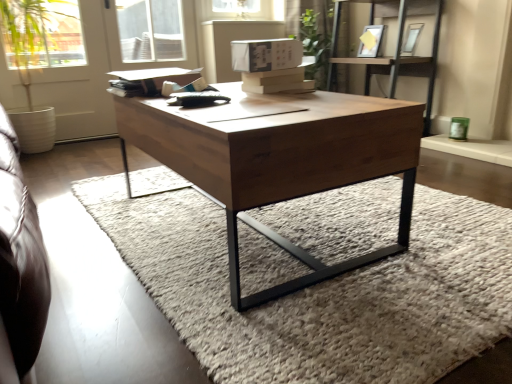
Locate an element on the screen. green leafy plant at upper center is located at coordinates (312, 33).

Measure the distance between wooden coffee table at center and camera.

wooden coffee table at center is 34.90 inches from camera.

The width and height of the screenshot is (512, 384). What do you see at coordinates (396, 50) in the screenshot? I see `wooden shelf at upper right` at bounding box center [396, 50].

Find the location of a particular element. green leafy plant at upper center is located at coordinates (312, 33).

Which point is more distant from viewer, (36, 79) or (162, 25)?

The point (162, 25) is more distant.

Is white matte screen door at upper left positioned far away from transparent glass window at upper center?

They are positioned close to each other.

From the image's perspective, which one is positioned higher, white matte screen door at upper left or transparent glass window at upper center?

transparent glass window at upper center, from the image's perspective.

Is white matte screen door at upper left bigger than transparent glass window at upper center?

Correct, white matte screen door at upper left is larger in size than transparent glass window at upper center.

Considering the sizes of transparent glass window at upper center and wooden coffee table at center in the image, is transparent glass window at upper center wider or thinner than wooden coffee table at center?

In the image, transparent glass window at upper center appears to be more narrow than wooden coffee table at center.

Which is in front, point (123, 45) or point (329, 142)?

The point (329, 142) is more forward.

Is wooden shelf at upper right touching white matte screen door at upper left?

wooden shelf at upper right and white matte screen door at upper left are clearly separated.

From the image's perspective, between wooden shelf at upper right and white matte screen door at upper left, who is located below?

white matte screen door at upper left.

From a real-world perspective, which is physically below, wooden shelf at upper right or white matte screen door at upper left?

wooden shelf at upper right.

Considering the positions of point (376, 25) and point (134, 21), is point (376, 25) closer or farther from the camera than point (134, 21)?

Clearly, point (376, 25) is closer to the camera than point (134, 21).

Is matte white picture frame at upper center, arranged as the second picture frame when viewed from the right, bigger or smaller than transparent glass window at upper center?

matte white picture frame at upper center, arranged as the second picture frame when viewed from the right, is smaller than transparent glass window at upper center.

Considering the relative sizes of matte white picture frame at upper center, positioned as the 1th picture frame in left-to-right order, and transparent glass window at upper center in the image provided, is matte white picture frame at upper center, positioned as the 1th picture frame in left-to-right order, wider than transparent glass window at upper center?

Indeed, matte white picture frame at upper center, positioned as the 1th picture frame in left-to-right order, has a greater width compared to transparent glass window at upper center.

From a real-world perspective, which is physically above, matte white picture frame at upper center, positioned as the 1th picture frame in left-to-right order, or transparent glass window at upper center?

In real-world perspective, transparent glass window at upper center is above.

Considering the sizes of objects transparent glass window at upper center and wooden shelf at upper right in the image provided, who is taller, transparent glass window at upper center or wooden shelf at upper right?

wooden shelf at upper right is taller.

Where is `shelf located on the right of transparent glass window at upper center`? The image size is (512, 384). shelf located on the right of transparent glass window at upper center is located at coordinates (396, 50).

In the image, is transparent glass window at upper center positioned in front of or behind wooden shelf at upper right?

transparent glass window at upper center is behind wooden shelf at upper right.

From the image's perspective, is soft wool rug at center on green leafy plant at upper center?

Actually, soft wool rug at center appears below green leafy plant at upper center in the image.

Does point (365, 324) appear closer or farther from the camera than point (322, 21)?

Point (365, 324) appears to be closer to the viewer than point (322, 21).

Can we say soft wool rug at center lies outside green leafy plant at upper center?

Absolutely, soft wool rug at center is external to green leafy plant at upper center.

Who is more distant, wooden coffee table at center or transparent glass window at upper center?

transparent glass window at upper center is more distant.

The width and height of the screenshot is (512, 384). I want to click on coffee table lying in front of the transparent glass window at upper center, so click(279, 159).

Is wooden coffee table at center wider or thinner than transparent glass window at upper center?

Considering their sizes, wooden coffee table at center looks broader than transparent glass window at upper center.

Based on the photo, from the image's perspective, is wooden coffee table at center located beneath transparent glass window at upper center?

Yes.

Where is `screen door below the transparent glass window at upper center (from a real-world perspective)`? Image resolution: width=512 pixels, height=384 pixels. screen door below the transparent glass window at upper center (from a real-world perspective) is located at coordinates (80, 84).

Identify the location of coffee table lying in front of the transparent glass window at upper center. (279, 159).

When comparing their distances from matte silver picture frame at upper right, which is the 1th picture frame in right-to-left order, does green leafy plant at upper center or wooden shelf at upper right seem further?

green leafy plant at upper center is further to matte silver picture frame at upper right, which is the 1th picture frame in right-to-left order.

Considering their positions, is green leafy plant at upper center positioned closer to matte white picture frame at upper center, arranged as the second picture frame when viewed from the right, than transparent glass window at upper center?

Based on the image, green leafy plant at upper center appears to be nearer to matte white picture frame at upper center, arranged as the second picture frame when viewed from the right.

From the image, which object appears to be farther from wooden shelf at upper right, white matte screen door at upper left or wooden coffee table at center?

The object further to wooden shelf at upper right is white matte screen door at upper left.

Looking at the image, which one is located closer to wooden coffee table at center, white matte screen door at upper left or matte silver picture frame at upper right, arranged as the 2th picture frame when viewed from the left?

The object closer to wooden coffee table at center is white matte screen door at upper left.

Considering their positions, is transparent glass window at upper center positioned further to white matte screen door at upper left than wooden coffee table at center?

wooden coffee table at center is further to white matte screen door at upper left.

When comparing their distances from wooden shelf at upper right, does transparent glass window at upper center or wooden coffee table at center seem closer?

transparent glass window at upper center.

Considering their positions, is white matte screen door at upper left positioned closer to matte white picture frame at upper center, positioned as the 1th picture frame in left-to-right order, than matte silver picture frame at upper right, which is the 1th picture frame in right-to-left order?

matte silver picture frame at upper right, which is the 1th picture frame in right-to-left order, is positioned closer to the anchor matte white picture frame at upper center, positioned as the 1th picture frame in left-to-right order.

Estimate the real-world distances between objects in this image. Which object is further from wooden shelf at upper right, matte silver picture frame at upper right, arranged as the 2th picture frame when viewed from the left, or green leafy plant at upper center?

Based on the image, green leafy plant at upper center appears to be further to wooden shelf at upper right.

Where is `window between white matte screen door at upper left and matte white picture frame at upper center, positioned as the 1th picture frame in left-to-right order`? Image resolution: width=512 pixels, height=384 pixels. window between white matte screen door at upper left and matte white picture frame at upper center, positioned as the 1th picture frame in left-to-right order is located at coordinates (150, 30).

Locate an element on the screen. screen door located between soft wool rug at center and matte white picture frame at upper center, arranged as the second picture frame when viewed from the right, in the depth direction is located at coordinates (80, 84).

The width and height of the screenshot is (512, 384). What are the coordinates of `picture frame situated between transparent glass window at upper center and wooden shelf at upper right from left to right` in the screenshot? It's located at (370, 41).

Locate an element on the screen. The image size is (512, 384). picture frame between wooden shelf at upper right and matte white picture frame at upper center, positioned as the 1th picture frame in left-to-right order, in the front-back direction is located at coordinates (x=411, y=38).